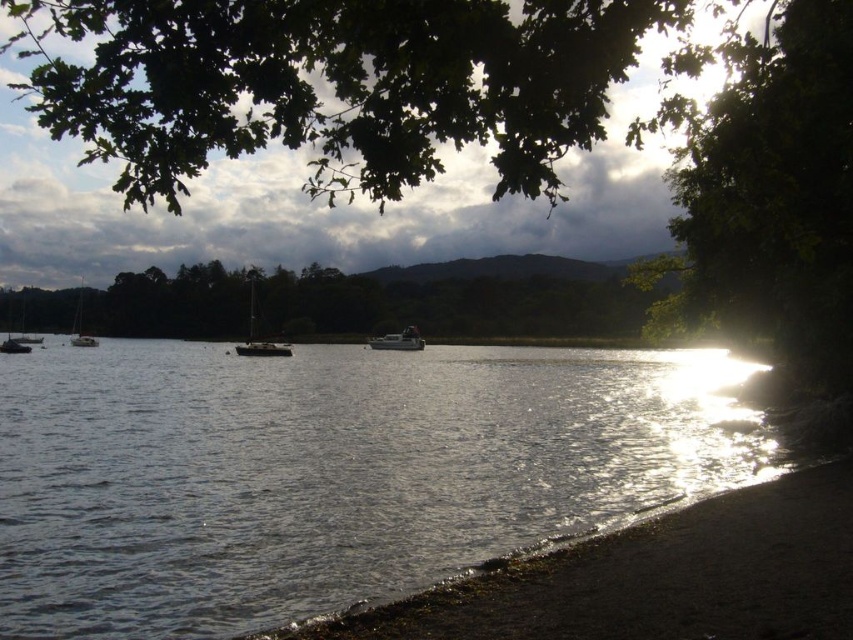
Which is in front, point (408, 342) or point (22, 348)?

Point (22, 348) is more forward.

What do you see at coordinates (398, 340) in the screenshot?
I see `metallic gray boat at center` at bounding box center [398, 340].

The height and width of the screenshot is (640, 853). Find the location of `metallic gray boat at center`. metallic gray boat at center is located at coordinates (398, 340).

Is point (253, 269) farther from camera compared to point (22, 346)?

Yes, point (253, 269) is farther from viewer.

Between shiny silver sailboat at center and metallic silver boat at lower left, which one appears on the right side from the viewer's perspective?

From the viewer's perspective, shiny silver sailboat at center appears more on the right side.

Is point (252, 300) behind point (22, 348)?

Yes.

This screenshot has height=640, width=853. Find the location of `shiny silver sailboat at center`. shiny silver sailboat at center is located at coordinates (256, 332).

Can you confirm if green leafy tree at upper right is positioned below metallic gray boat at center?

No, green leafy tree at upper right is not below metallic gray boat at center.

Which of these two, green leafy tree at upper right or metallic gray boat at center, stands taller?

green leafy tree at upper right is taller.

I want to click on green leafy tree at upper right, so click(x=767, y=189).

Identify the location of green leafy tree at upper right. (767, 189).